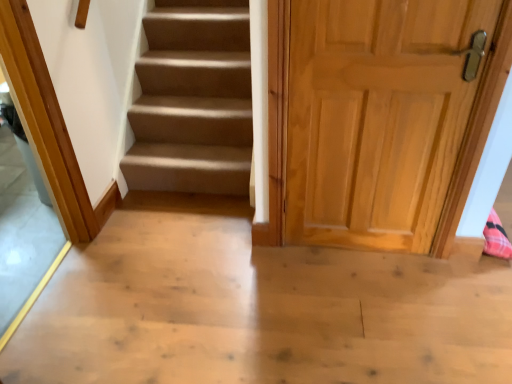
Locate an element on the screen. Image resolution: width=512 pixels, height=384 pixels. free point below transparent glass door at left (from a real-world perspective) is located at coordinates (49, 289).